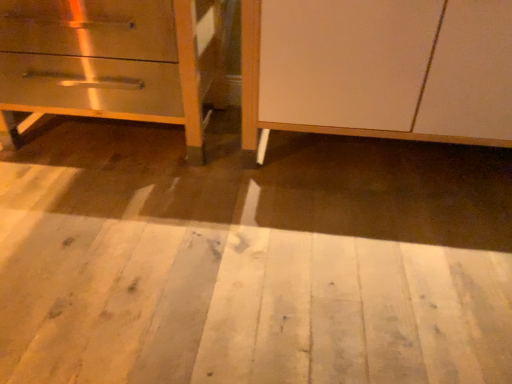
Question: Relative to white wood floor at lower center, is white matte cabinet at center in front or behind?

Choices:
 (A) front
 (B) behind

Answer: (B)

Question: From the image's perspective, relative to white wood floor at lower center, is white matte cabinet at center above or below?

Choices:
 (A) above
 (B) below

Answer: (A)

Question: Based on their relative distances, which object is nearer to the metallic silver drawer at left?

Choices:
 (A) white matte cabinet at center
 (B) white wood floor at lower center

Answer: (A)

Question: Which object is the closest to the white wood floor at lower center?

Choices:
 (A) metallic silver drawer at left
 (B) white matte cabinet at center

Answer: (B)